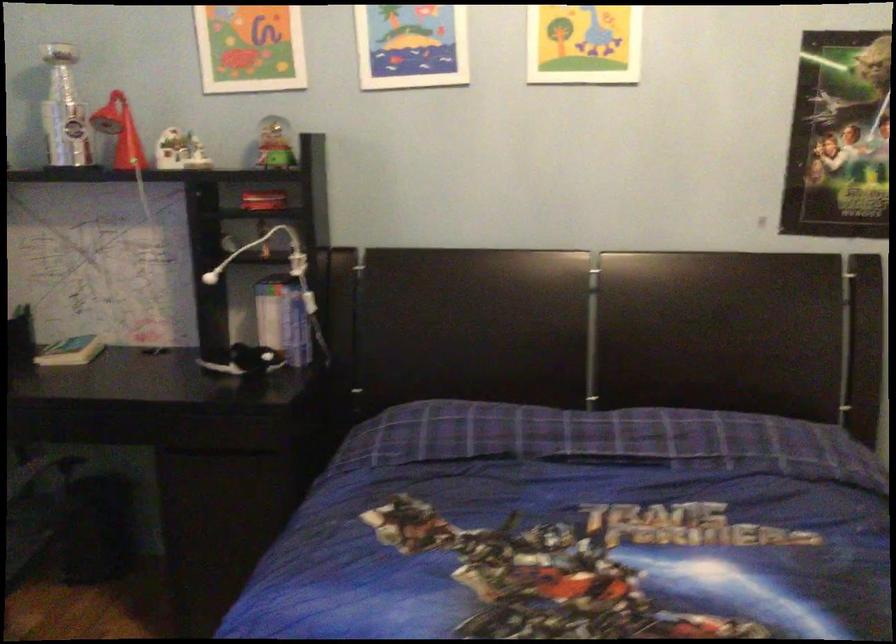
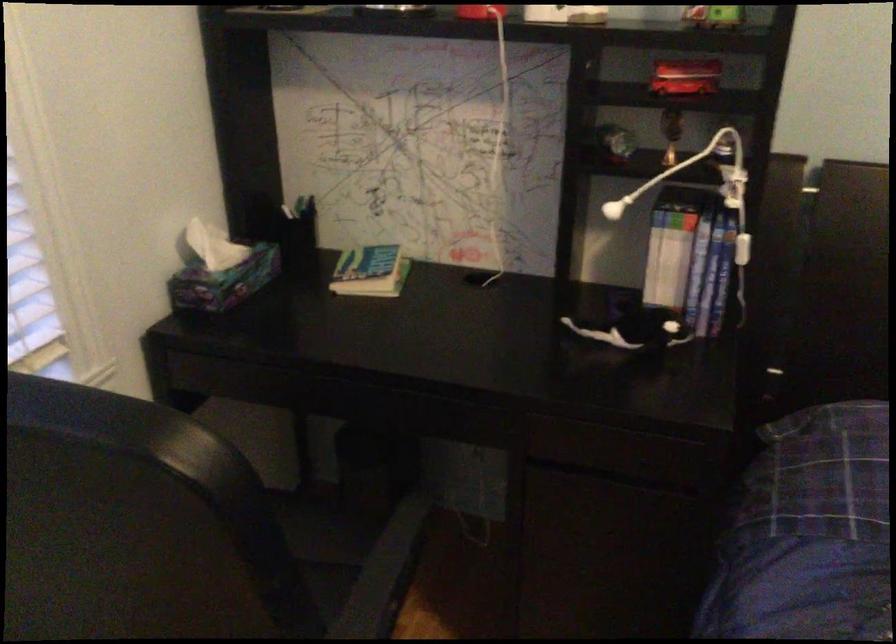
Locate, in the second image, the point that corresponds to (x=297, y=330) in the first image.

(707, 288)